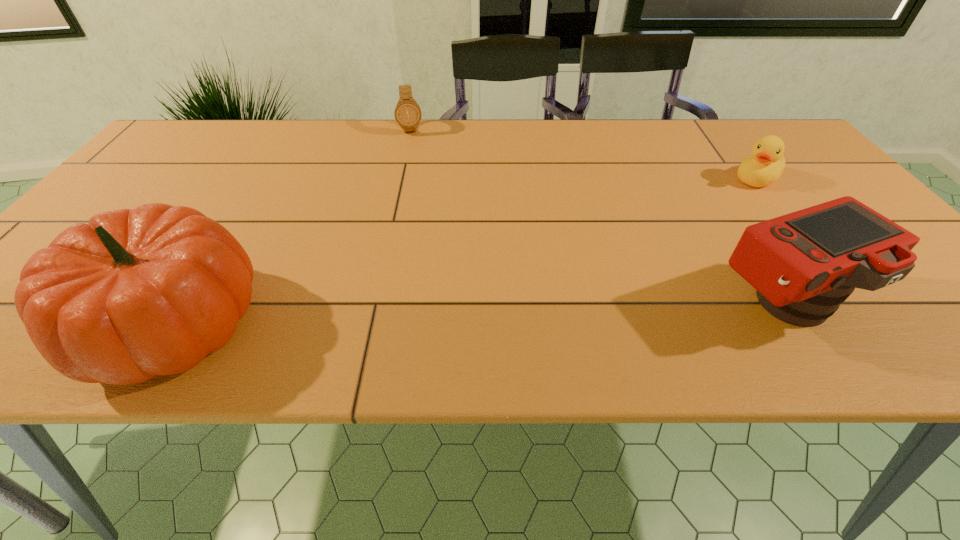
I want to click on the leftmost object, so click(135, 293).

At what (x,y) coordinates should I click in order to perform the action: click on the third shortest object. Please return your answer as a coordinate pair (x, y). The height and width of the screenshot is (540, 960). Looking at the image, I should click on (803, 265).

I want to click on the second farthest object, so click(766, 165).

The image size is (960, 540). Identify the location of watch. (407, 112).

Where is `the third object from right to left`? Image resolution: width=960 pixels, height=540 pixels. the third object from right to left is located at coordinates (407, 112).

Identify the location of free space located on the back of the leftmost object. (270, 163).

Image resolution: width=960 pixels, height=540 pixels. Identify the location of vacant space located 0.060m on the right of the camera. (883, 306).

The width and height of the screenshot is (960, 540). In order to click on vacant area situated on the face of the duckling in this screenshot , I will do `click(654, 249)`.

The height and width of the screenshot is (540, 960). What are the coordinates of `free space located 0.360m on the face of the duckling` in the screenshot? It's located at (657, 247).

You are a GUI agent. You are given a task and a screenshot of the screen. Output one action in this format:
    pyautogui.click(x=<x>, y=<y>)
    Task: Click on the vacant space located 0.400m on the face of the duckling
    The height and width of the screenshot is (540, 960).
    Given the screenshot: What is the action you would take?
    pyautogui.click(x=645, y=255)